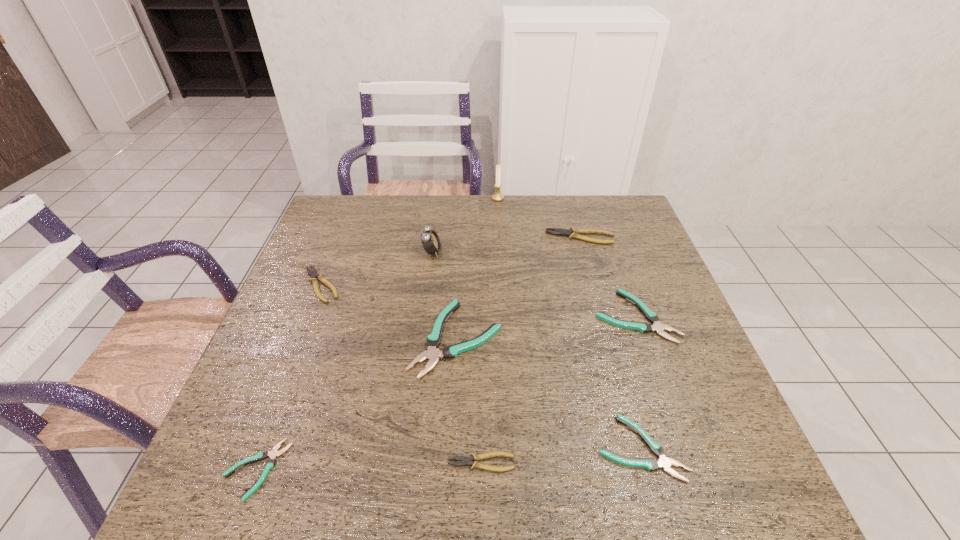
What are the coordinates of `the tallest object` in the screenshot? It's located at (497, 196).

Locate an element on the screen. The width and height of the screenshot is (960, 540). candle holder is located at coordinates (497, 196).

Where is `alarm clock`? alarm clock is located at coordinates (430, 240).

Locate an element on the screen. The image size is (960, 540). white alarm clock is located at coordinates (430, 240).

Identify the location of the farthest yellow pliers. pyautogui.click(x=572, y=233).

Find the location of a particular element. the biggest yellow pliers is located at coordinates (572, 233).

This screenshot has height=540, width=960. In order to click on the biggest teal pliers in this screenshot , I will do `click(432, 354)`.

You are a GUI agent. You are given a task and a screenshot of the screen. Output one action in this format:
    pyautogui.click(x=<x>, y=<y>)
    Task: Click on the third smallest teal pliers
    
    Given the screenshot: What is the action you would take?
    pyautogui.click(x=651, y=316)

Where is `the leftmost yellow pliers`? the leftmost yellow pliers is located at coordinates (314, 275).

You are a GUI agent. You are given a task and a screenshot of the screen. Output one action in this format:
    pyautogui.click(x=<x>, y=<y>)
    Task: Click on the second nearest yellow pliers
    The image size is (960, 540).
    Given the screenshot: What is the action you would take?
    pyautogui.click(x=314, y=275)